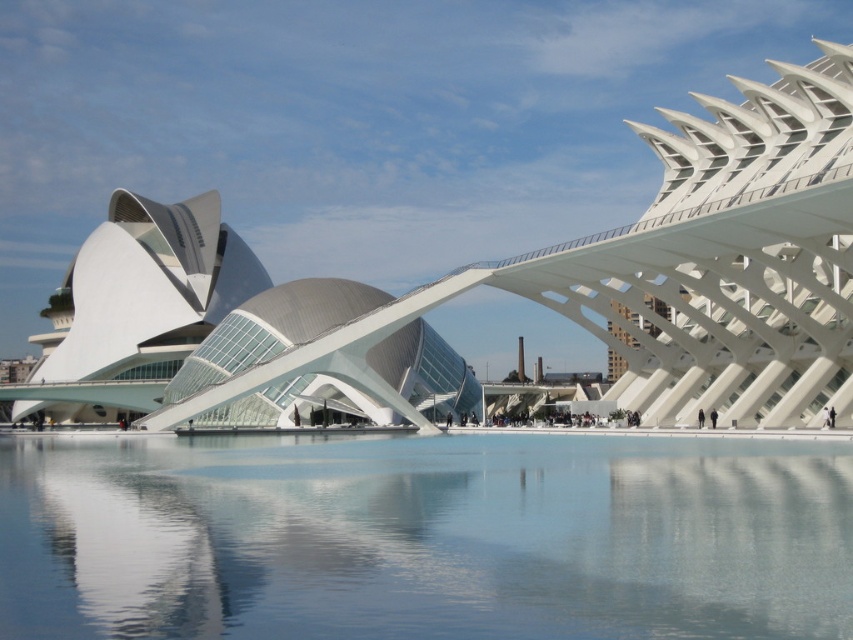
Is transparent glass water at center shorter than white matte building at center?

Correct, transparent glass water at center is not as tall as white matte building at center.

Does transparent glass water at center have a larger size compared to white matte building at center?

Incorrect, transparent glass water at center is not larger than white matte building at center.

Describe the element at coordinates (425, 538) in the screenshot. This screenshot has width=853, height=640. I see `transparent glass water at center` at that location.

This screenshot has height=640, width=853. I want to click on transparent glass water at center, so click(425, 538).